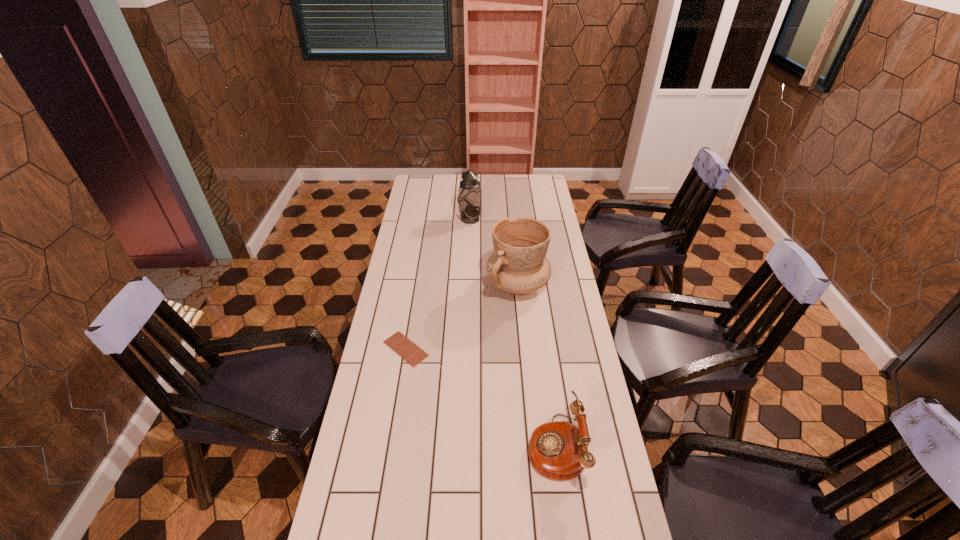
The height and width of the screenshot is (540, 960). Find the location of `vacant space located on the dial of the nearest object`. vacant space located on the dial of the nearest object is located at coordinates (500, 447).

What are the coordinates of `vacant region located 0.210m on the dial of the nearest object` in the screenshot? It's located at (455, 447).

Where is `vacant space located on the dial of the nearest object`? This screenshot has width=960, height=540. vacant space located on the dial of the nearest object is located at coordinates (424, 447).

Locate an element on the screen. Image resolution: width=960 pixels, height=540 pixels. free region located on the back of the second nearest object is located at coordinates (418, 278).

Locate an element on the screen. The width and height of the screenshot is (960, 540). object at the left edge is located at coordinates (410, 352).

The image size is (960, 540). I want to click on pottery present at the right edge, so click(518, 265).

The image size is (960, 540). Identify the location of telephone present at the right edge. pos(558,450).

The width and height of the screenshot is (960, 540). In the image, there is a desktop. In order to click on free region at the far edge in this screenshot , I will do `click(503, 192)`.

The image size is (960, 540). Identify the location of vacant space at the left edge of the desktop. (417, 340).

In the image, there is a desktop. What are the coordinates of `vacant space at the right edge` in the screenshot? It's located at (549, 205).